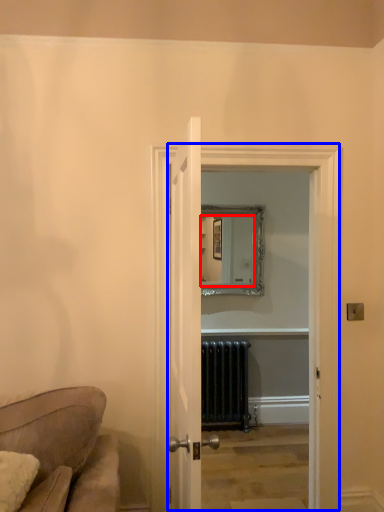
Question: Which point is closer to the camera, mirror (highlighted by a red box) or glass door (highlighted by a blue box)?

Choices:
 (A) mirror
 (B) glass door

Answer: (B)